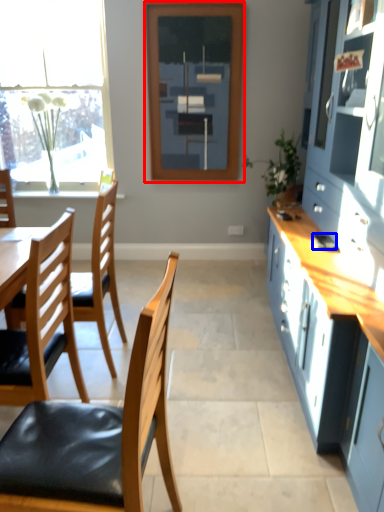
Question: Which point is closer to the camera, window frame (highlighted by a red box) or mobile phone (highlighted by a blue box)?

Choices:
 (A) window frame
 (B) mobile phone

Answer: (B)